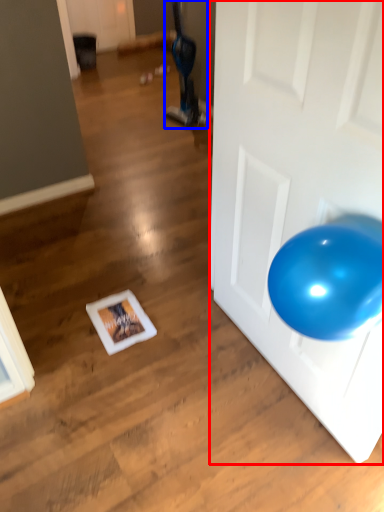
Question: Which point is further to the camera, door (highlighted by a red box) or bean bag chair (highlighted by a blue box)?

Choices:
 (A) door
 (B) bean bag chair

Answer: (B)